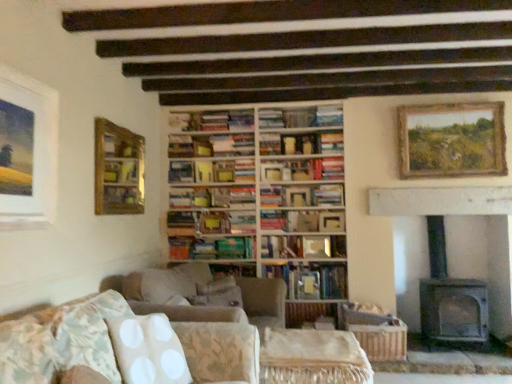
Question: Considering the relative sizes of wooden-framed painting at upper right, which appears as the 2th picture frame when viewed from the front, and beige fabric side table at center in the image provided, is wooden-framed painting at upper right, which appears as the 2th picture frame when viewed from the front, wider than beige fabric side table at center?

Choices:
 (A) yes
 (B) no

Answer: (B)

Question: From a real-world perspective, is wooden-framed painting at upper right, marked as the 1th picture frame in a right-to-left arrangement, located higher than beige fabric side table at center?

Choices:
 (A) yes
 (B) no

Answer: (A)

Question: Is beige fabric side table at center at the back of wooden-framed painting at upper right, marked as the 1th picture frame in a right-to-left arrangement?

Choices:
 (A) yes
 (B) no

Answer: (B)

Question: Can you confirm if wooden-framed painting at upper right, marked as the 1th picture frame in a right-to-left arrangement, is shorter than beige fabric side table at center?

Choices:
 (A) yes
 (B) no

Answer: (B)

Question: Is the surface of wooden-framed painting at upper right, which is the second picture frame in back-to-front order, in direct contact with beige fabric side table at center?

Choices:
 (A) no
 (B) yes

Answer: (A)

Question: Is wooden-framed painting at upper right, marked as the third picture frame in a left-to-right arrangement, smaller than beige fabric side table at center?

Choices:
 (A) no
 (B) yes

Answer: (B)

Question: Is wooden-framed painting at upper right, marked as the third picture frame in a left-to-right arrangement, to the right of hardcover book at center, which is the 7th book from top to bottom, from the viewer's perspective?

Choices:
 (A) yes
 (B) no

Answer: (A)

Question: From a real-world perspective, is wooden-framed painting at upper right, which is the second picture frame in back-to-front order, positioned over hardcover book at center, which is counted as the 1th book, starting from the bottom, based on gravity?

Choices:
 (A) no
 (B) yes

Answer: (B)

Question: From a real-world perspective, does wooden-framed painting at upper right, which appears as the 2th picture frame when viewed from the front, sit lower than hardcover book at center, which is counted as the 1th book, starting from the bottom?

Choices:
 (A) no
 (B) yes

Answer: (A)

Question: Is hardcover book at center, which is counted as the 1th book, starting from the bottom, at the back of wooden-framed painting at upper right, which appears as the 2th picture frame when viewed from the front?

Choices:
 (A) yes
 (B) no

Answer: (B)

Question: Would you say wooden-framed painting at upper right, which is the second picture frame in back-to-front order, is outside hardcover book at center, which is counted as the 1th book, starting from the bottom?

Choices:
 (A) no
 (B) yes

Answer: (B)

Question: Is wooden-framed painting at upper right, which is the second picture frame in back-to-front order, oriented towards hardcover book at center, which is the 7th book from top to bottom?

Choices:
 (A) yes
 (B) no

Answer: (B)

Question: Does hardcover book at center, the fifth book viewed from the top, have a larger size compared to gray stone fireplace at right?

Choices:
 (A) yes
 (B) no

Answer: (B)